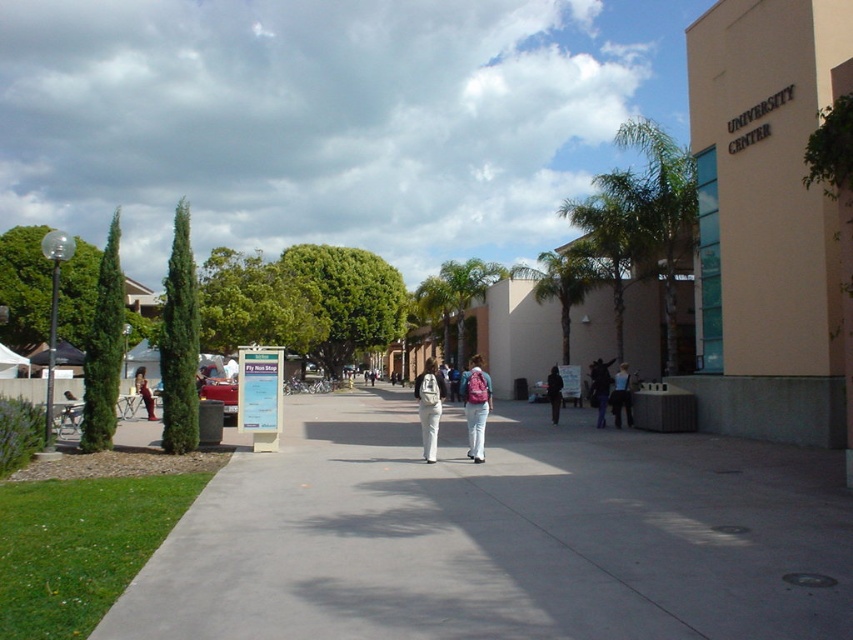
Question: In this image, where is green leafy palm tree at center-right located relative to dark blue backpack at center?

Choices:
 (A) above
 (B) below

Answer: (A)

Question: Which object appears farthest from the camera in this image?

Choices:
 (A) dark blue backpack at center
 (B) green leafy palm tree at right
 (C) dark blue jeans at center
 (D) blue fabric backpack at center

Answer: (B)

Question: Which object appears closest to the camera in this image?

Choices:
 (A) denim jacket at left
 (B) gray concrete sidewalk at center
 (C) green leafy palm tree at right

Answer: (B)

Question: Does pink backpack at center come behind blue fabric backpack at center?

Choices:
 (A) yes
 (B) no

Answer: (B)

Question: Estimate the real-world distances between objects in this image. Which object is farther from the blue fabric backpack at center?

Choices:
 (A) white matte backpack at center
 (B) pink backpack at center

Answer: (A)

Question: Does green leafy palm tree at right appear over denim jacket at left?

Choices:
 (A) yes
 (B) no

Answer: (A)